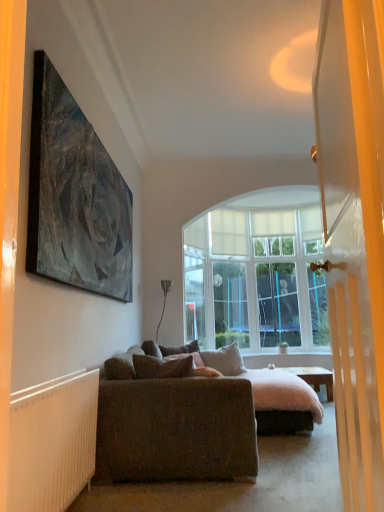
Question: Can you confirm if velvet purple pillow at center, placed as the third pillow when sorted from front to back, is wider than brown fabric pillow at center, positioned as the third pillow in back-to-front order?

Choices:
 (A) no
 (B) yes

Answer: (B)

Question: Considering the relative sizes of velvet purple pillow at center, placed as the third pillow when sorted from front to back, and brown fabric pillow at center, the first pillow when ordered from front to back, in the image provided, is velvet purple pillow at center, placed as the third pillow when sorted from front to back, taller than brown fabric pillow at center, the first pillow when ordered from front to back,?

Choices:
 (A) no
 (B) yes

Answer: (B)

Question: From a real-world perspective, is velvet purple pillow at center, marked as the 1th pillow in a back-to-front arrangement, positioned under brown fabric pillow at center, positioned as the third pillow in back-to-front order, based on gravity?

Choices:
 (A) yes
 (B) no

Answer: (A)

Question: Does velvet purple pillow at center, marked as the 1th pillow in a back-to-front arrangement, appear on the right side of brown fabric pillow at center, the first pillow when ordered from front to back?

Choices:
 (A) no
 (B) yes

Answer: (B)

Question: Can brown fabric pillow at center, the first pillow when ordered from front to back, be found inside velvet purple pillow at center, placed as the third pillow when sorted from front to back?

Choices:
 (A) yes
 (B) no

Answer: (B)

Question: Is velvet purple pillow at center, placed as the third pillow when sorted from front to back, at the left side of brown fabric pillow at center, positioned as the third pillow in back-to-front order?

Choices:
 (A) yes
 (B) no

Answer: (B)

Question: Is white ribbed radiator at lower left inside velvet purple pillow at center, marked as the 1th pillow in a back-to-front arrangement?

Choices:
 (A) yes
 (B) no

Answer: (B)

Question: Considering the relative positions of velvet purple pillow at center, placed as the third pillow when sorted from front to back, and white ribbed radiator at lower left in the image provided, is velvet purple pillow at center, placed as the third pillow when sorted from front to back, to the left of white ribbed radiator at lower left from the viewer's perspective?

Choices:
 (A) yes
 (B) no

Answer: (B)

Question: Can you confirm if velvet purple pillow at center, placed as the third pillow when sorted from front to back, is wider than white ribbed radiator at lower left?

Choices:
 (A) yes
 (B) no

Answer: (A)

Question: Is the depth of velvet purple pillow at center, placed as the third pillow when sorted from front to back, less than that of white ribbed radiator at lower left?

Choices:
 (A) yes
 (B) no

Answer: (B)

Question: From a real-world perspective, is velvet purple pillow at center, marked as the 1th pillow in a back-to-front arrangement, over white ribbed radiator at lower left?

Choices:
 (A) no
 (B) yes

Answer: (B)

Question: Does velvet purple pillow at center, marked as the 1th pillow in a back-to-front arrangement, have a greater height compared to white ribbed radiator at lower left?

Choices:
 (A) no
 (B) yes

Answer: (A)

Question: Can you confirm if dark gray matte painting at upper left is shorter than wooden desk at center?

Choices:
 (A) yes
 (B) no

Answer: (B)